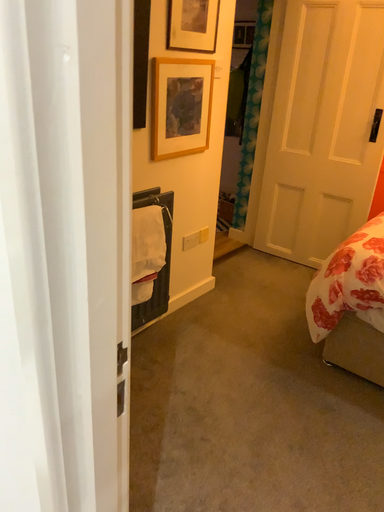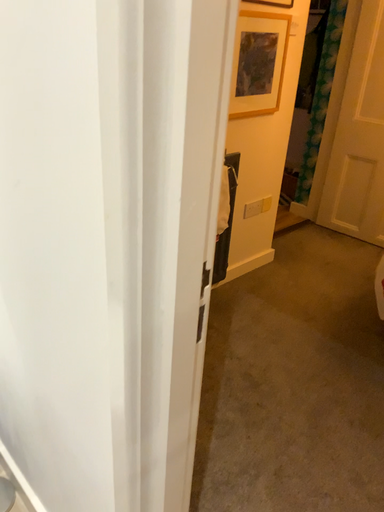
Question: How did the camera likely rotate when shooting the video?

Choices:
 (A) rotated left
 (B) rotated right

Answer: (A)